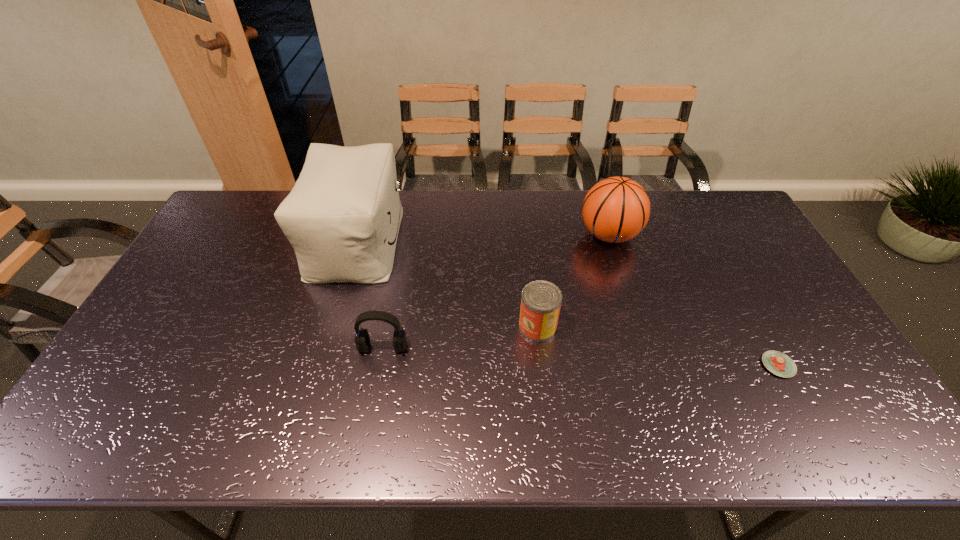
The image size is (960, 540). In order to click on vacant region between the headset and the pastry in this screenshot , I will do `click(581, 356)`.

The image size is (960, 540). I want to click on empty space that is in between the shortest object and the fourth shortest object, so click(693, 300).

Locate an element on the screen. This screenshot has width=960, height=540. free spot between the rightmost object and the fourth shortest object is located at coordinates (693, 300).

Where is `free space between the can and the pastry`? Image resolution: width=960 pixels, height=540 pixels. free space between the can and the pastry is located at coordinates (658, 346).

This screenshot has width=960, height=540. What are the coordinates of `free spot between the pastry and the cushion` in the screenshot? It's located at (567, 303).

The height and width of the screenshot is (540, 960). I want to click on blank region between the third object from right to left and the fourth shortest object, so click(573, 281).

This screenshot has height=540, width=960. Find the location of `vacant point located between the pastry and the basketball`. vacant point located between the pastry and the basketball is located at coordinates (693, 300).

Identify the location of empty location between the cushion and the headset. This screenshot has height=540, width=960. (370, 294).

Where is `free spot between the second tallest object and the rightmost object`? free spot between the second tallest object and the rightmost object is located at coordinates (693, 300).

Image resolution: width=960 pixels, height=540 pixels. Find the location of `free space between the second tallest object and the headset`. free space between the second tallest object and the headset is located at coordinates tap(496, 291).